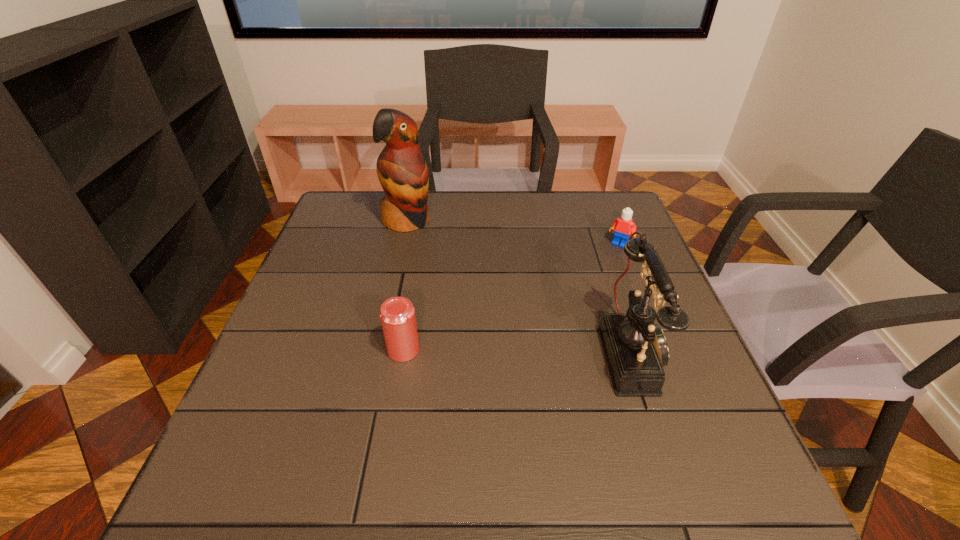
Identify the location of vacant area situated 0.320m on the face of the second farthest object. (569, 320).

Find the location of a particular element. vacant point located on the face of the second farthest object is located at coordinates (561, 333).

You are a GUI agent. You are given a task and a screenshot of the screen. Output one action in this format:
    pyautogui.click(x=<x>, y=<y>)
    Task: Click on the free spot located on the face of the second farthest object
    
    Given the screenshot: What is the action you would take?
    pyautogui.click(x=576, y=309)

Find the location of a particular element. object that is at the far edge is located at coordinates (402, 171).

Locate an element on the screen. object present at the near edge is located at coordinates (635, 349).

The width and height of the screenshot is (960, 540). I want to click on telephone positioned at the right edge, so click(x=635, y=349).

Identify the location of Lego that is at the right edge. (623, 226).

The height and width of the screenshot is (540, 960). In order to click on object that is at the near right corner in this screenshot , I will do `click(635, 349)`.

You are a GUI agent. You are given a task and a screenshot of the screen. Output one action in this format:
    pyautogui.click(x=<x>, y=<y>)
    Task: Click on the vacant space at the far edge of the desktop
    This screenshot has width=960, height=540.
    Given the screenshot: What is the action you would take?
    pyautogui.click(x=532, y=193)

Where is `vacant space at the near edge`? This screenshot has width=960, height=540. vacant space at the near edge is located at coordinates (416, 420).